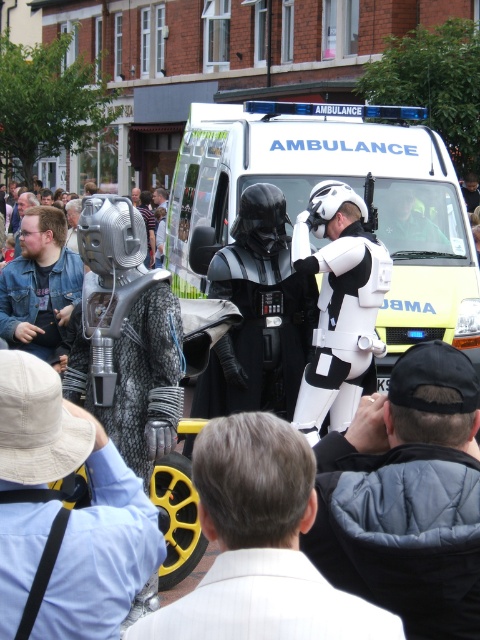
Which of these two, denim jacket at left or green reflective helmet at center, stands shorter?

green reflective helmet at center is shorter.

Does point (50, 324) come behind point (391, 218)?

That is False.

Which is in front, point (31, 280) or point (427, 250)?

Point (31, 280)

In order to click on denim jacket at left in this screenshot , I will do `click(39, 284)`.

Between point (113, 490) and point (155, 627), which one is positioned in front?

Positioned in front is point (155, 627).

Can you confirm if light beige fabric hat at lower left is positioned to the right of white textured suit at center?

Incorrect, light beige fabric hat at lower left is not on the right side of white textured suit at center.

Does point (47, 486) lie in front of point (276, 605)?

No, (47, 486) is behind (276, 605).

You are a GUI agent. You are given a task and a screenshot of the screen. Output one action in this format:
    pyautogui.click(x=<x>, y=<y>)
    Task: Click on the light beige fabric hat at lower left
    Image resolution: width=480 pixels, height=640 pixels.
    Given the screenshot: What is the action you would take?
    pyautogui.click(x=68, y=513)

How far apart are black matte helmet at center and white textured suit at center?

14.50 feet

Does black matte helmet at center have a greater height compared to white textured suit at center?

Yes.

Identify the location of black matte helmet at center. This screenshot has height=640, width=480. (257, 314).